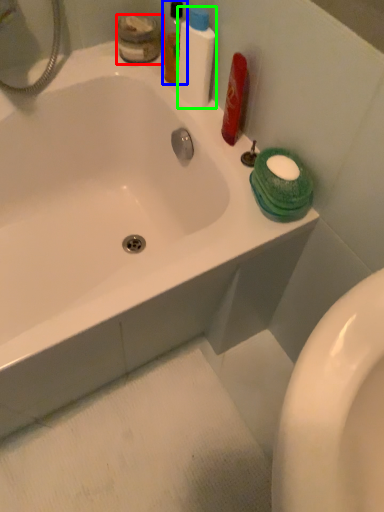
Question: Estimate the real-world distances between objects in this image. Which object is farther from toiletry (highlighted by a red box), mouthwash (highlighted by a blue box) or cleaning product (highlighted by a green box)?

Choices:
 (A) mouthwash
 (B) cleaning product

Answer: (B)